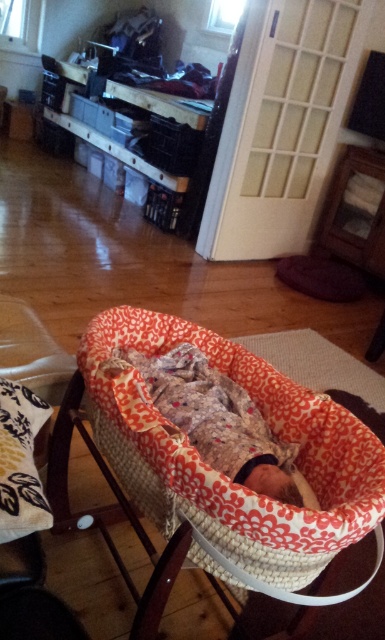
Does floral fabric bassinet at center have a lesser width compared to floral fabric baby at center?

No.

Based on the photo, does floral fabric bassinet at center appear over floral fabric baby at center?

Incorrect, floral fabric bassinet at center is not positioned above floral fabric baby at center.

Between point (276, 422) and point (279, 442), which one is positioned in front?

Positioned in front is point (279, 442).

The width and height of the screenshot is (385, 640). I want to click on floral fabric bassinet at center, so click(x=219, y=472).